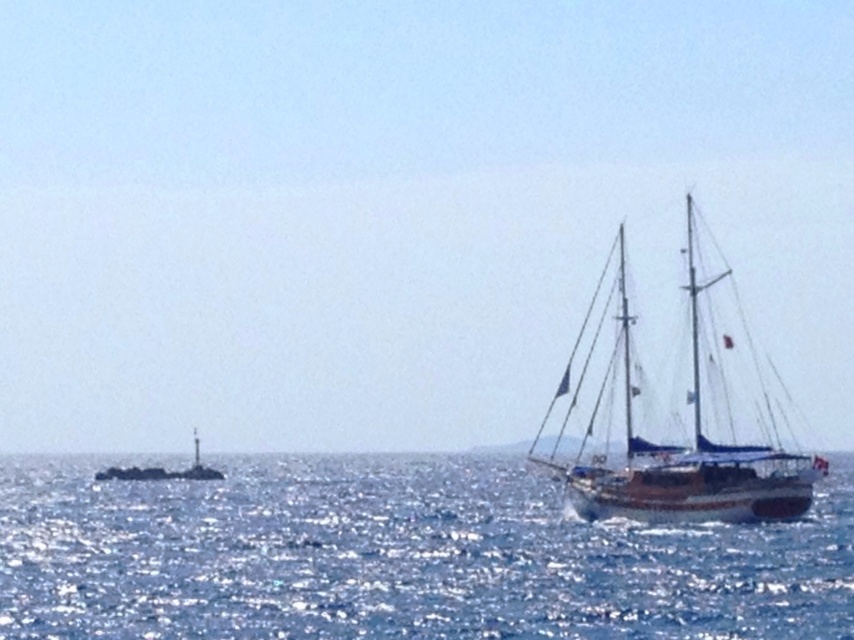
Question: Is blue water at lower right positioned before white plastic buoy at left?

Choices:
 (A) no
 (B) yes

Answer: (B)

Question: Which point is farther to the camera?

Choices:
 (A) (217, 477)
 (B) (250, 608)

Answer: (A)

Question: Which object is the closest to the white plastic buoy at left?

Choices:
 (A) wooden sailboat at right
 (B) blue water at lower right

Answer: (B)

Question: Which object appears farthest from the camera in this image?

Choices:
 (A) blue water at lower right
 (B) wooden sailboat at right

Answer: (B)

Question: Can you confirm if blue water at lower right is positioned to the left of white plastic buoy at left?

Choices:
 (A) no
 (B) yes

Answer: (A)

Question: Can you confirm if blue water at lower right is wider than wooden sailboat at right?

Choices:
 (A) no
 (B) yes

Answer: (B)